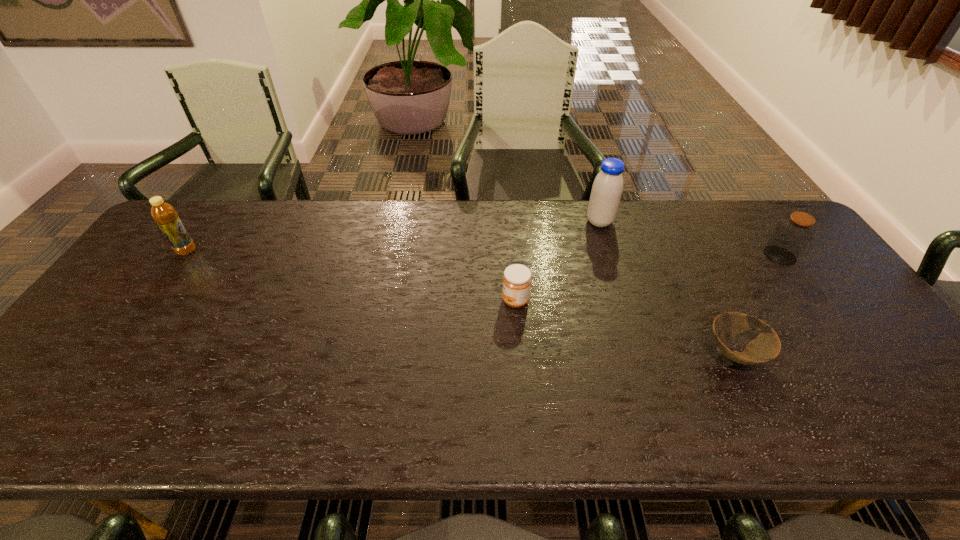
You are a GUI agent. You are given a task and a screenshot of the screen. Output one action in this format:
    pyautogui.click(x=<x>, y=<y>)
    Task: Click on the vacant region located on the right of the farthest object
    This screenshot has height=540, width=960.
    Given the screenshot: What is the action you would take?
    pyautogui.click(x=663, y=222)

Where is `free space located 0.240m on the front of the fourth shortest object`? The width and height of the screenshot is (960, 540). free space located 0.240m on the front of the fourth shortest object is located at coordinates (137, 321).

Identify the location of free location located on the front of the jar. click(828, 322).

Identify the location of vacant area situated 0.260m on the front label of the jam. Image resolution: width=960 pixels, height=540 pixels. (405, 301).

Where is `blank space located 0.350m on the front label of the jam`? This screenshot has width=960, height=540. blank space located 0.350m on the front label of the jam is located at coordinates tap(372, 301).

Locate an element on the screen. The height and width of the screenshot is (540, 960). vacant area situated 0.380m on the front label of the jam is located at coordinates (360, 301).

I want to click on free space located on the back of the nearest object, so click(698, 279).

Locate an element on the screen. This screenshot has height=540, width=960. soya milk at the far edge is located at coordinates (607, 188).

Identify the location of bottle positioned at the far edge. (164, 214).

This screenshot has width=960, height=540. In order to click on jar situated at the far edge in this screenshot , I will do `click(792, 235)`.